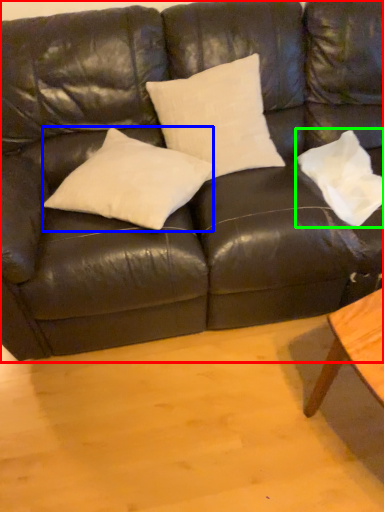
Question: Considering the real-world distances, which object is closest to studio couch (highlighted by a red box)? pillow (highlighted by a blue box) or pillow (highlighted by a green box).

Choices:
 (A) pillow
 (B) pillow

Answer: (A)